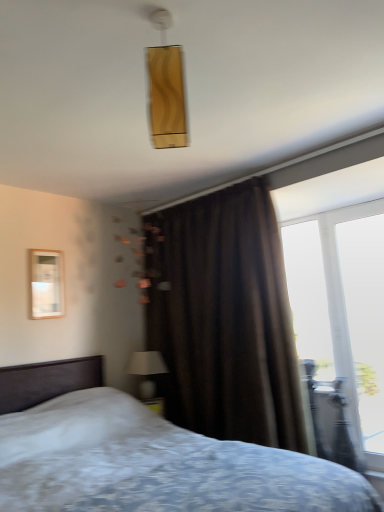
Question: Considering the positions of matte white lampshade at lower center and transparent glass window at right in the image, is matte white lampshade at lower center wider or thinner than transparent glass window at right?

Choices:
 (A) wide
 (B) thin

Answer: (A)

Question: Relative to transparent glass window at right, is matte white lampshade at lower center in front or behind?

Choices:
 (A) behind
 (B) front

Answer: (A)

Question: Estimate the real-world distances between objects in this image. Which object is closer to the white textured bed at center?

Choices:
 (A) transparent glass window at right
 (B) wooden frame at left
 (C) metallic silver armchair at right
 (D) gold textured rectangular light fixture at upper center
 (E) brown velvet curtain at center

Answer: (E)

Question: Estimate the real-world distances between objects in this image. Which object is closer to the metallic silver armchair at right?

Choices:
 (A) wooden frame at left
 (B) white textured bed at center
 (C) gold textured rectangular light fixture at upper center
 (D) brown velvet curtain at center
 (E) matte white lampshade at lower center

Answer: (D)